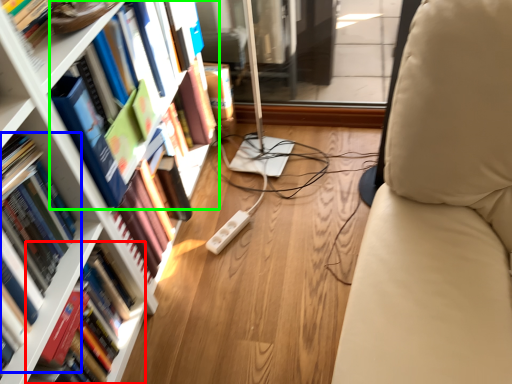
Question: Considering the real-world distances, which object is closest to book (highlighted by a red box)? book (highlighted by a blue box) or book (highlighted by a green box).

Choices:
 (A) book
 (B) book

Answer: (A)